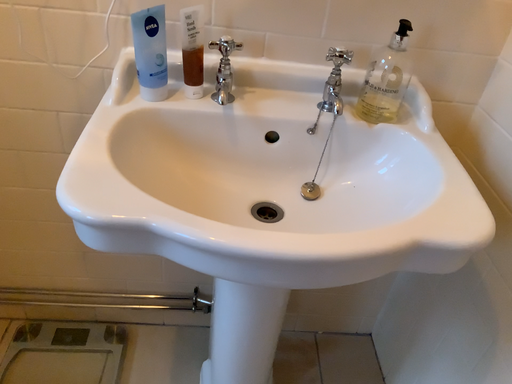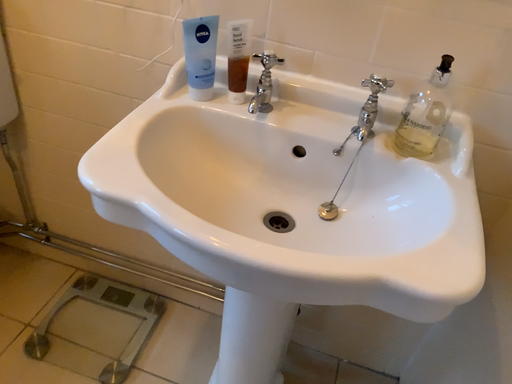
Question: How did the camera likely rotate when shooting the video?

Choices:
 (A) rotated left
 (B) rotated right

Answer: (A)